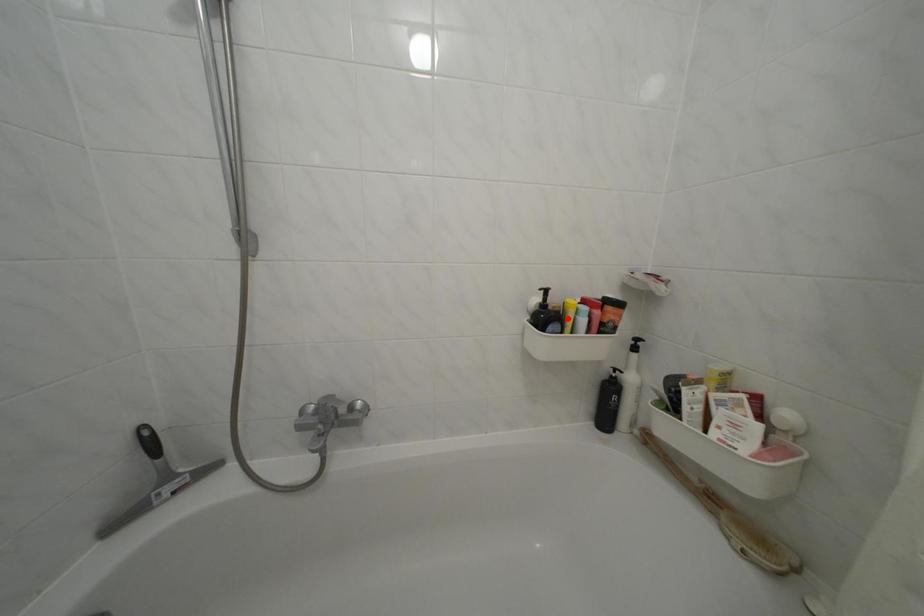
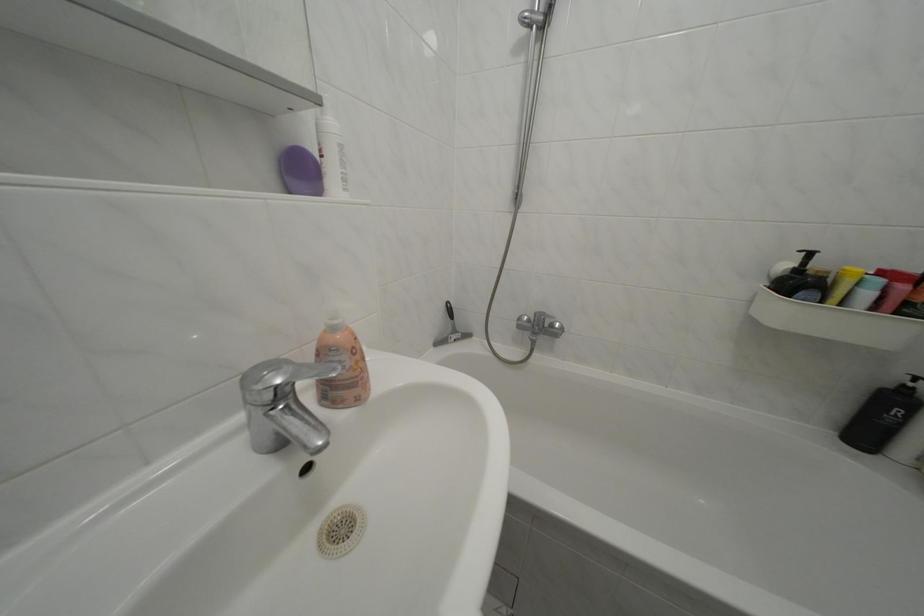
Locate, in the second image, the point that corresponds to the highlighted location in the first image.

(833, 285)